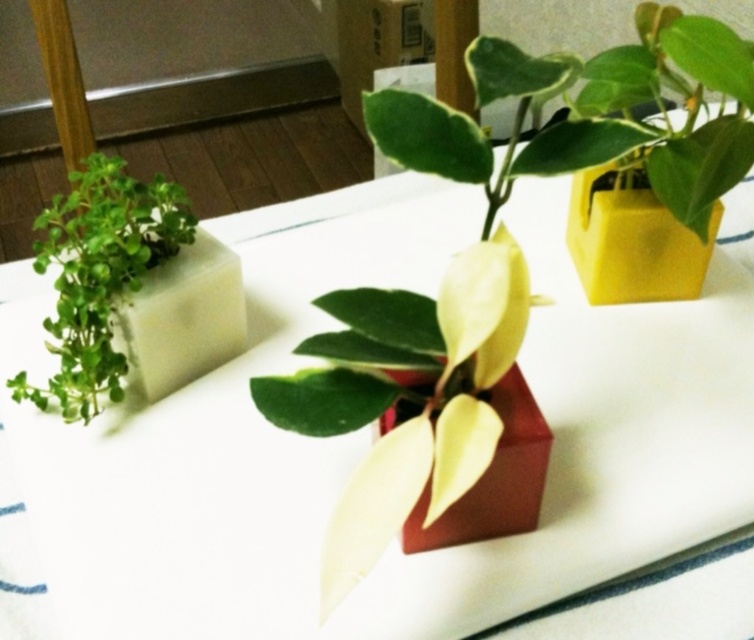
Question: Estimate the real-world distances between objects in this image. Which object is farther from the green matte plant at left?

Choices:
 (A) matte gold leaf at center
 (B) white matte cube at left

Answer: (A)

Question: Which object is the farthest from the white matte cube at left?

Choices:
 (A) green matte plant at left
 (B) matte gold leaf at center
 (C) matte red cube at center

Answer: (B)

Question: Is green matte plant at left bigger than matte gold leaf at center?

Choices:
 (A) no
 (B) yes

Answer: (B)

Question: Does green matte plant at left lie in front of matte red cube at center?

Choices:
 (A) no
 (B) yes

Answer: (A)

Question: Can you confirm if matte red cube at center is bigger than matte gold leaf at center?

Choices:
 (A) no
 (B) yes

Answer: (B)

Question: Which point appears closest to the camera in this image?

Choices:
 (A) (372, 436)
 (B) (72, 312)
 (C) (498, 257)

Answer: (C)